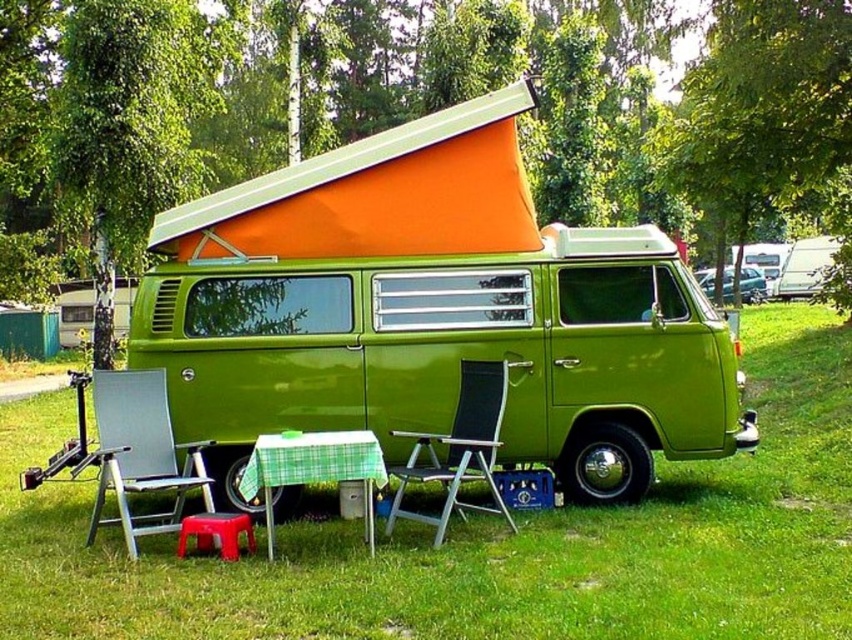
Is green matte van at center positioned before black mesh chair at center?

No, it is not.

Is green matte van at center wider than black mesh chair at center?

Correct, the width of green matte van at center exceeds that of black mesh chair at center.

Is point (205, 413) farther from viewer compared to point (464, 401)?

That is True.

This screenshot has width=852, height=640. Find the location of `green matte van at center`. green matte van at center is located at coordinates (432, 312).

Does point (442, 378) come behind point (798, 477)?

That is False.

Which is below, green matte van at center or green grass at lower center?

green grass at lower center is below.

Which is in front, point (398, 456) or point (53, 604)?

Positioned in front is point (53, 604).

The image size is (852, 640). What are the coordinates of `green matte van at center` in the screenshot? It's located at (432, 312).

Does green matte van at center appear on the right side of rubberized plastic stool at lower center?

Indeed, green matte van at center is positioned on the right side of rubberized plastic stool at lower center.

Who is more forward, [366,284] or [220,556]?

Point [220,556] is in front.

You are a GUI agent. You are given a task and a screenshot of the screen. Output one action in this format:
    pyautogui.click(x=<x>, y=<y>)
    Task: Click on the green matte van at center
    This screenshot has height=640, width=852.
    Given the screenshot: What is the action you would take?
    pyautogui.click(x=432, y=312)